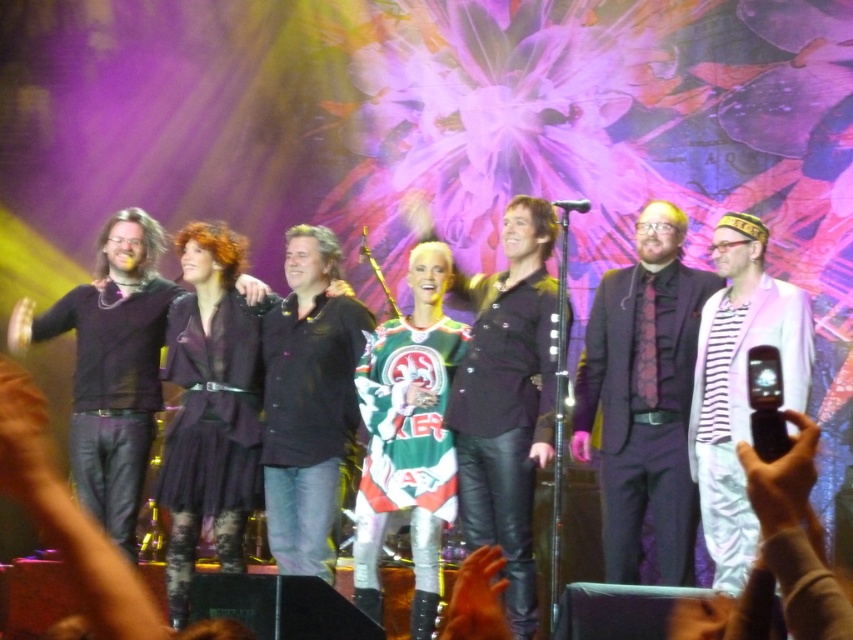
Question: Which is farther from the white striped shirt at right?

Choices:
 (A) matte black jacket at center
 (B) dark purple suit at center

Answer: (A)

Question: Which point is farther to the camera?

Choices:
 (A) dark purple suit at center
 (B) matte black jacket at center

Answer: (B)

Question: Considering the relative positions of dark purple suit at center and white striped shirt at right in the image provided, where is dark purple suit at center located with respect to white striped shirt at right?

Choices:
 (A) below
 (B) above

Answer: (B)

Question: Which object appears farthest from the camera in this image?

Choices:
 (A) matte black jacket at center
 (B) white striped shirt at right

Answer: (A)

Question: Does dark purple suit at center appear on the right side of matte black jacket at center?

Choices:
 (A) no
 (B) yes

Answer: (B)

Question: Can you confirm if white striped shirt at right is thinner than matte black jacket at center?

Choices:
 (A) no
 (B) yes

Answer: (A)